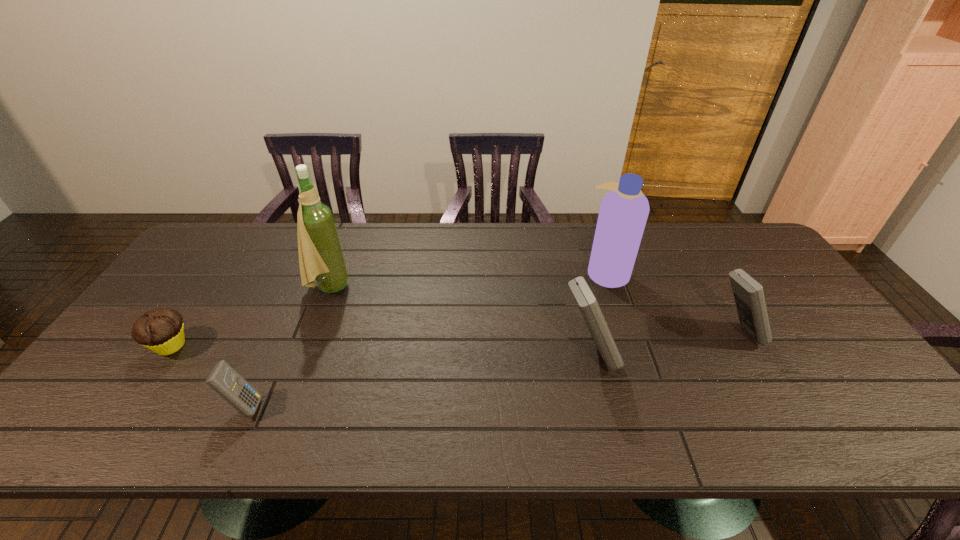
This screenshot has height=540, width=960. What are the coordinates of `the nearest object` in the screenshot? It's located at (223, 379).

Locate an element on the screen. The width and height of the screenshot is (960, 540). the shortest calculator is located at coordinates (223, 379).

At what (x,y) coordinates should I click in order to perform the action: click on the second calculator from right to left. Please return your answer as a coordinate pair (x, y). Looking at the image, I should click on (585, 299).

The image size is (960, 540). I want to click on the second shortest calculator, so click(748, 294).

The image size is (960, 540). I want to click on the rightmost object, so click(x=748, y=294).

At what (x,y) coordinates should I click in order to perform the action: click on wine bottle. Please return your answer as a coordinate pair (x, y). This screenshot has width=960, height=540. Looking at the image, I should click on (321, 258).

The width and height of the screenshot is (960, 540). Identify the location of the leftmost object. (161, 330).

You are a GUI agent. You are given a task and a screenshot of the screen. Output one action in this format:
    pyautogui.click(x=<x>, y=<y>)
    Task: Click on the shortest object
    
    Given the screenshot: What is the action you would take?
    pyautogui.click(x=161, y=330)

Identify the location of the fifth shortest object. (624, 210).

Find the location of `vacant area situated 0.190m on the front-facing side of the fifth tallest object`. vacant area situated 0.190m on the front-facing side of the fifth tallest object is located at coordinates (346, 406).